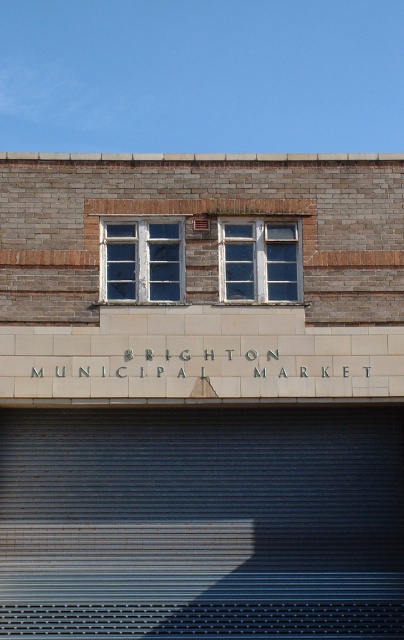
You are a delivery person trying to enter the Brighton Municipal Market. You see the metallic gray garage door at bottom and the white tile sign at center. Which object is located below the other?

The metallic gray garage door at bottom is positioned under white tile sign at center.

You are an architect evaluating the Brighton Municipal Market building. You notice the white tile sign at center and the white wooden window at upper center. Which of these two elements takes up more visual space on the building facade?

The white wooden window at upper center takes up more visual space than the white tile sign at center because the white tile sign at center occupies less space than the white wooden window at upper center.